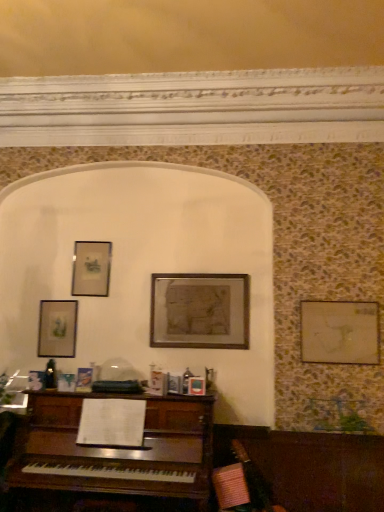
Locate an element on the screen. The height and width of the screenshot is (512, 384). free space above wooden picture frame at right, which is the 4th picture frame from left to right (from a real-world perspective) is located at coordinates (345, 298).